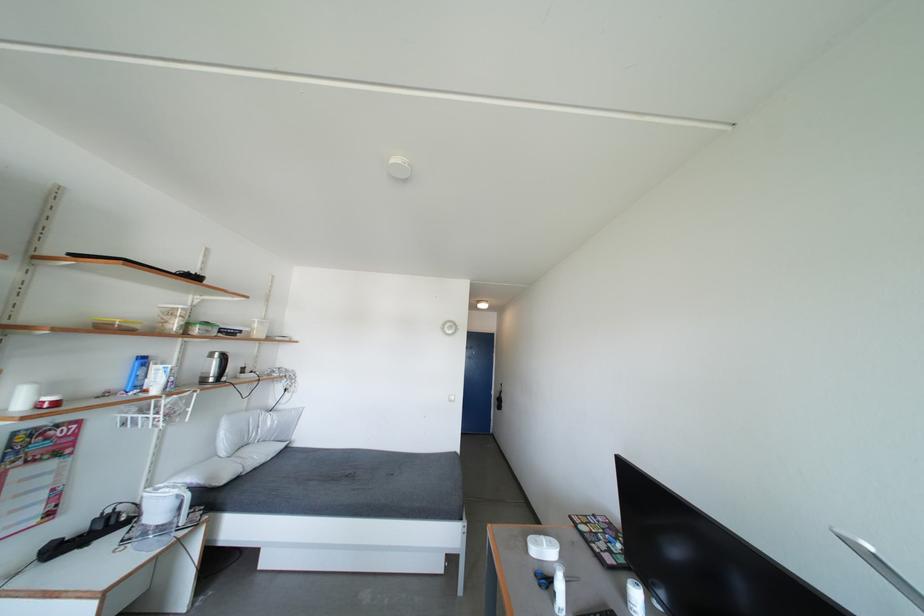
Find the location of a particular element. The width and height of the screenshot is (924, 616). container with yellow lid is located at coordinates (116, 323).